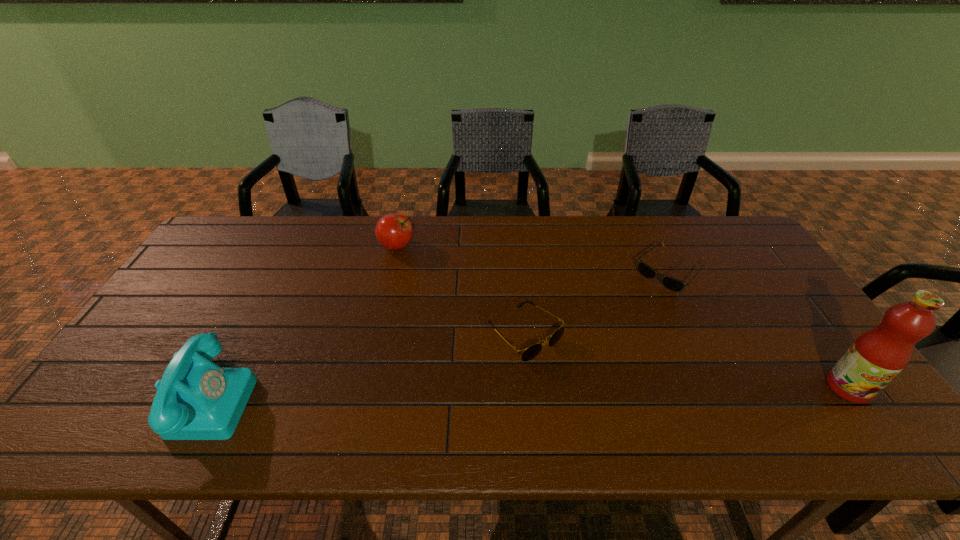
The image size is (960, 540). Identify the location of free space at the far right corner. (713, 219).

This screenshot has width=960, height=540. I want to click on free space between the second object from left to right and the rightmost object, so click(622, 317).

Where is `free spot between the rightmost object and the leftmost object`? free spot between the rightmost object and the leftmost object is located at coordinates (528, 393).

You are a GUI agent. You are given a task and a screenshot of the screen. Output one action in this format:
    pyautogui.click(x=<x>, y=<y>)
    Task: Click on the free space between the third object from right to left and the telephone
    This screenshot has height=540, width=960.
    Given the screenshot: What is the action you would take?
    [367, 366]

Find the location of a particular element. free space between the fruit juice and the left sunglasses is located at coordinates (686, 361).

This screenshot has width=960, height=540. Find the location of `vacant area that lies between the farther sunglasses and the apple`. vacant area that lies between the farther sunglasses and the apple is located at coordinates (533, 259).

At what (x,y) coordinates should I click in order to perform the action: click on vacant area between the farther sunglasses and the rightmost object. Please return your answer as a coordinate pair (x, y). The width and height of the screenshot is (960, 540). Looking at the image, I should click on (758, 329).

At what (x,y) coordinates should I click in order to perform the action: click on free space between the nearer sunglasses and the shorter sunglasses. Please return your answer as a coordinate pair (x, y). Looking at the image, I should click on (597, 303).

At what (x,y) coordinates should I click in order to perform the action: click on free space between the third object from right to left and the shorter sunglasses. Please return your answer as a coordinate pair (x, y). The height and width of the screenshot is (540, 960). Looking at the image, I should click on pos(597,303).

This screenshot has width=960, height=540. In order to click on free spot between the second tallest object and the second object from right to left in this screenshot , I will do `click(439, 335)`.